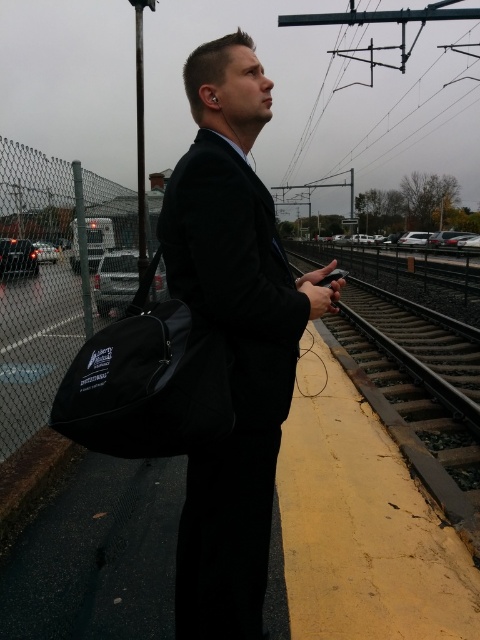
You are a tailor who needs to determine which item requires more fabric between the matte black suit at center and the black fabric bag at left. Based on their sizes, which one would need more fabric?

The matte black suit at center requires more fabric than the black fabric bag at left because it has a larger size.

You are a photographer trying to capture the man in the matte black suit at center. The platform has a yellow edge marked along its boundary. To ensure safety, you must stay within the platform area. Where should you position yourself relative to the point marked at coordinates (232,337) to take the photo without crossing the yellow edge?

Position yourself behind the point marked at coordinates (232,337), which marks the matte black suit at center, to stay within the platform area and avoid crossing the yellow edge.